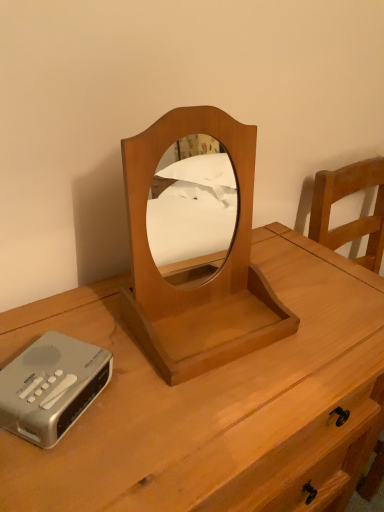
I want to click on free spot in front of wooden mirror at center, so coord(192,418).